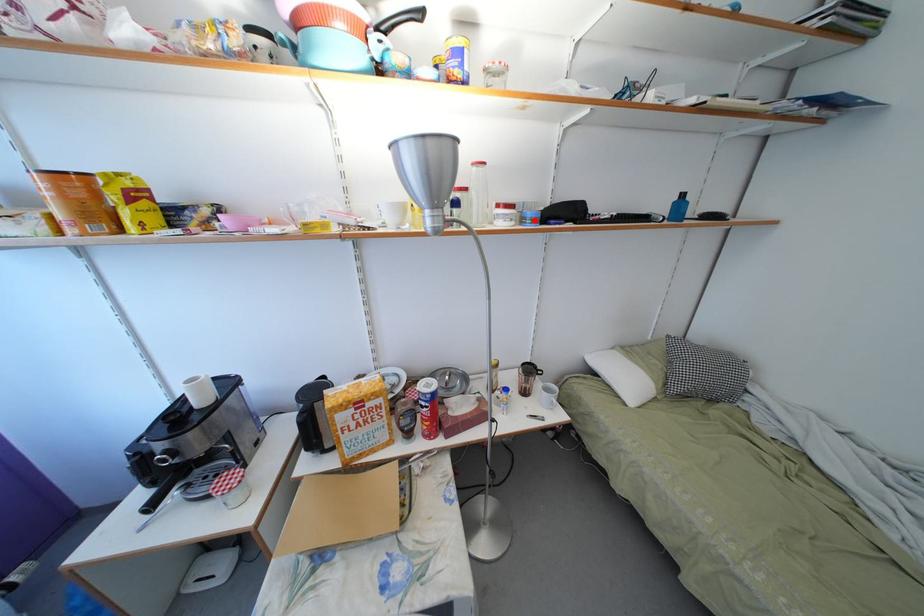
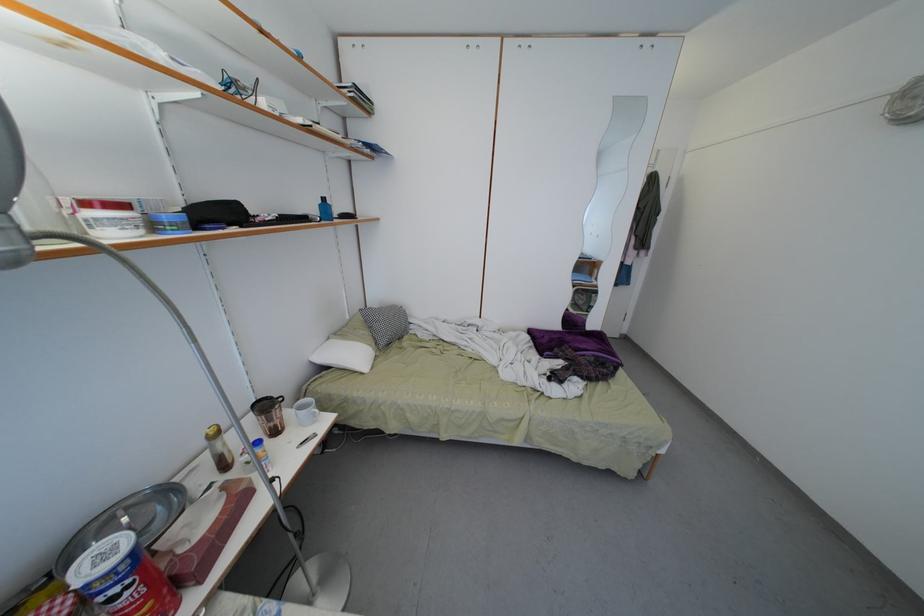
The point at the highlighted location is marked in the first image. Where is the corresponding point in the second image?

(171, 224)